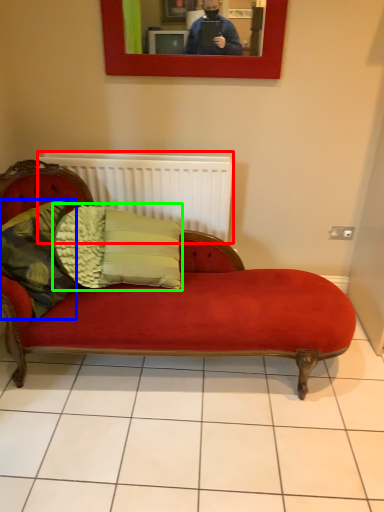
Question: Considering the real-world distances, which object is closest to radiator (highlighted by a red box)? pillow (highlighted by a blue box) or pillow (highlighted by a green box).

Choices:
 (A) pillow
 (B) pillow

Answer: (B)